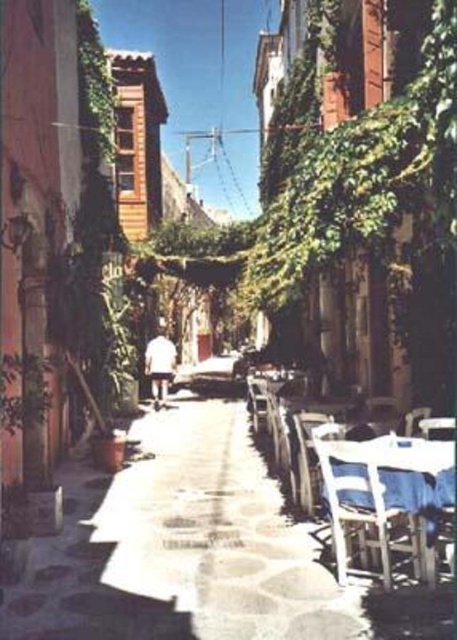
Question: Is white matte shirt at center above white plastic chair at lower right?

Choices:
 (A) no
 (B) yes

Answer: (B)

Question: Which is farther from the white matte shirt at center?

Choices:
 (A) white plastic chair at center
 (B) white plastic chair at lower right
 (C) wooden table at lower right

Answer: (C)

Question: Can you confirm if wooden table at lower right is positioned below white matte shirt at center?

Choices:
 (A) yes
 (B) no

Answer: (A)

Question: Can you confirm if wooden table at lower right is positioned to the right of white plastic chair at center?

Choices:
 (A) yes
 (B) no

Answer: (A)

Question: Estimate the real-world distances between objects in this image. Which object is closer to the white plastic chair at center?

Choices:
 (A) wooden table at lower right
 (B) white plastic chair at lower right
 (C) white matte shirt at center

Answer: (B)

Question: Estimate the real-world distances between objects in this image. Which object is closer to the wooden table at lower right?

Choices:
 (A) white plastic chair at lower right
 (B) white matte shirt at center
 (C) white plastic chair at center

Answer: (C)